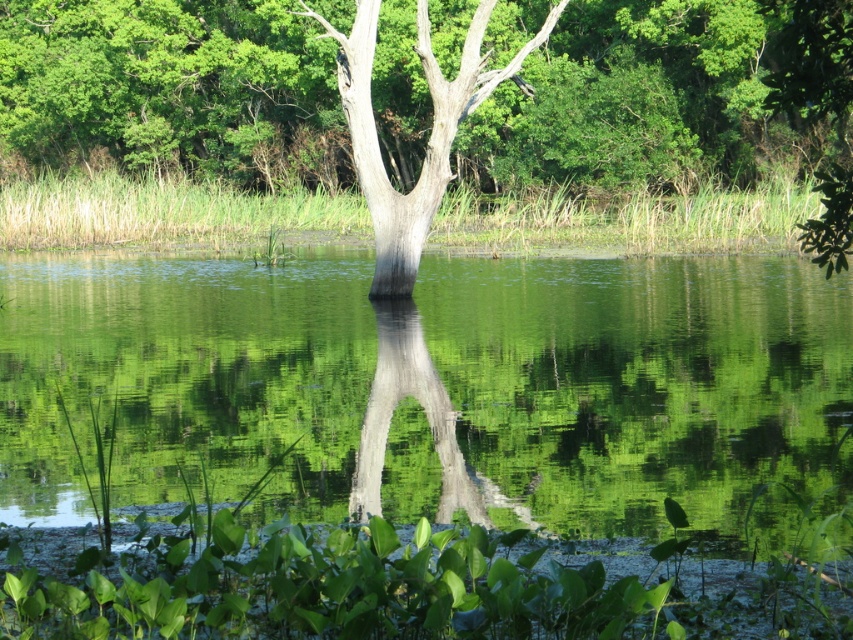
Question: Which is nearer to the smooth bark tree at center?

Choices:
 (A) smooth gray tree trunk at center
 (B) green reflective water at center
 (C) smooth gray tree at center

Answer: (C)

Question: Can you confirm if green reflective water at center is smaller than smooth gray tree at center?

Choices:
 (A) yes
 (B) no

Answer: (B)

Question: Among these points, which one is nearest to the camera?

Choices:
 (A) (418, 180)
 (B) (724, 307)
 (C) (614, 36)

Answer: (A)

Question: Can you confirm if smooth bark tree at center is thinner than smooth gray tree at center?

Choices:
 (A) yes
 (B) no

Answer: (B)

Question: Which object is positioned farthest from the smooth gray tree at center?

Choices:
 (A) smooth bark tree at center
 (B) green reflective water at center
 (C) smooth gray tree trunk at center

Answer: (A)

Question: Is smooth bark tree at center closer to camera compared to smooth gray tree trunk at center?

Choices:
 (A) yes
 (B) no

Answer: (A)